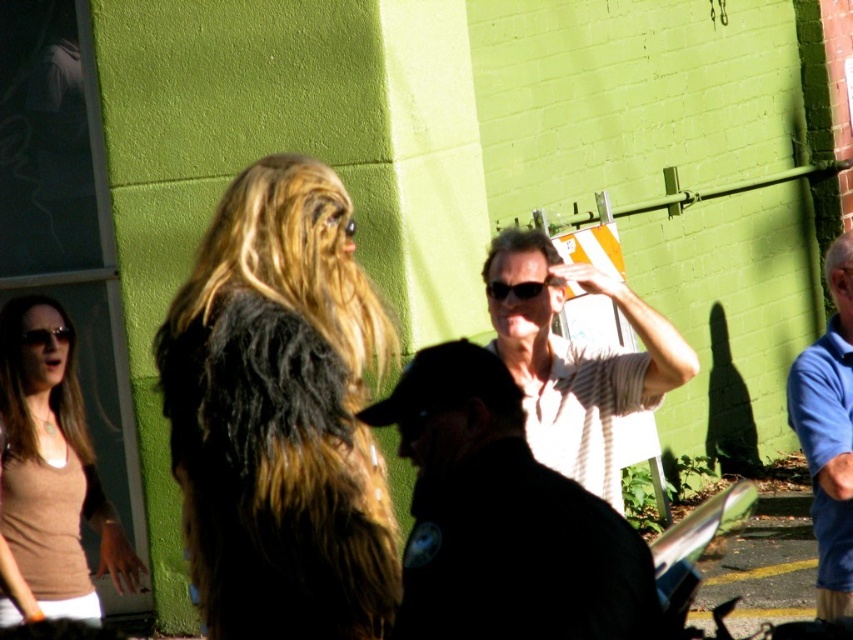
You are a photographer trying to capture a candid shot of both the blue cotton shirt at right and the black plastic sunglasses at center. Given that your camera has a maximum focus range of 1 meter, will you be able to include both subjects in the same frame without moving the camera?

The blue cotton shirt at right and the black plastic sunglasses at center are 92.07 centimeters apart from each other. Since 92.07 cm is less than 1 meter, the camera can focus on both subjects within the same frame without moving.

You are standing at the camera position and want to take a photo of the shaggy fur coat at center. Considering the distance, will you need to zoom in or zoom out to get a clear picture of it?

The shaggy fur coat at center is 4.33 meters away from the camera. Since it is at a moderate distance, you might need to zoom in slightly to ensure it fills the frame properly for a clear picture.

You are standing in the scene and want to take a photo of the black plastic goggles at upper left without including the white striped shirt at center in the frame. Is this possible given their relative sizes?

The white striped shirt at center is much taller than the black plastic goggles at upper left, so it might block the view. However, since the goggles are at upper left and the shirt is at center, adjusting the camera angle to focus on the upper left while avoiding the center area could potentially exclude the shirt. The size difference might make it challenging, but positioning carefully might work.